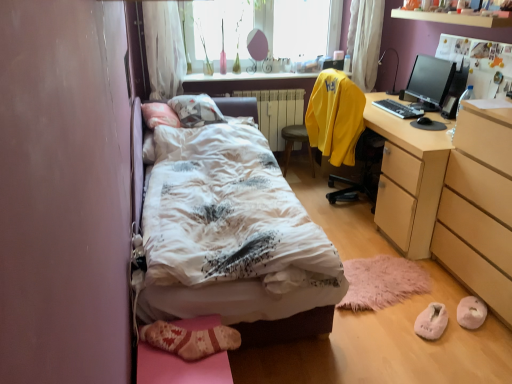
What is the approximate width of yellow fabric chair at center?

yellow fabric chair at center is 13.83 inches in width.

What do you see at coordinates (431, 321) in the screenshot? The image size is (512, 384). I see `pink fuzzy slippers at lower right, positioned as the 2th shoe in front-to-back order` at bounding box center [431, 321].

Where is `white sheer curtain at upper left, the 2th curtain in the right-to-left sequence`? This screenshot has height=384, width=512. white sheer curtain at upper left, the 2th curtain in the right-to-left sequence is located at coordinates (164, 48).

Where is `pink fluffy yoga mat at lower right`? pink fluffy yoga mat at lower right is located at coordinates (382, 282).

What's the angular difference between knitted wool socks at lower left, the 1th shoe positioned from the front, and black glossy monitor at upper right's facing directions?

The angular difference between knitted wool socks at lower left, the 1th shoe positioned from the front, and black glossy monitor at upper right is 179 degrees.

Who is bigger, knitted wool socks at lower left, the 1th shoe positioned from the front, or black glossy monitor at upper right?

knitted wool socks at lower left, the 1th shoe positioned from the front.

Is knitted wool socks at lower left, the 1th shoe positioned from the front, to the right of black glossy monitor at upper right from the viewer's perspective?

No.

Is knitted wool socks at lower left, the third shoe from the right, not close to black glossy monitor at upper right?

That's right, there is a large distance between knitted wool socks at lower left, the third shoe from the right, and black glossy monitor at upper right.

Which is correct: wooden shelf at upper center is inside black glossy monitor at upper right, or outside of it?

wooden shelf at upper center is spatially situated outside black glossy monitor at upper right.

From the image's perspective, is wooden shelf at upper center located beneath black glossy monitor at upper right?

No.

Does wooden shelf at upper center come behind black glossy monitor at upper right?

No.

Can you confirm if black plastic keyboard at right is wider than white metallic radiator at center?

Incorrect, the width of black plastic keyboard at right does not surpass that of white metallic radiator at center.

Which is in front, black plastic keyboard at right or white metallic radiator at center?

black plastic keyboard at right.

Which of these two, black plastic keyboard at right or white metallic radiator at center, stands shorter?

Standing shorter between the two is black plastic keyboard at right.

Where is `desktop on the right of white metallic radiator at center`? The height and width of the screenshot is (384, 512). desktop on the right of white metallic radiator at center is located at coordinates (398, 109).

From the image's perspective, which is above, white sheer curtain at upper center, which ranks as the 1th curtain in right-to-left order, or wooden shelf at upper center?

white sheer curtain at upper center, which ranks as the 1th curtain in right-to-left order.

From a real-world perspective, is white sheer curtain at upper center, which ranks as the 1th curtain in right-to-left order, physically above wooden shelf at upper center?

Incorrect, from a real-world perspective, white sheer curtain at upper center, which ranks as the 1th curtain in right-to-left order, is lower than wooden shelf at upper center.

In the scene shown: Considering the relative positions of white sheer curtain at upper center, which ranks as the 1th curtain in right-to-left order, and wooden shelf at upper center in the image provided, is white sheer curtain at upper center, which ranks as the 1th curtain in right-to-left order, to the left of wooden shelf at upper center from the viewer's perspective?

Yes, white sheer curtain at upper center, which ranks as the 1th curtain in right-to-left order, is to the left of wooden shelf at upper center.

Which is farther from the camera, (362, 55) or (442, 21)?

The point (362, 55) is behind.

Is knitted wool socks at lower left, arranged as the first shoe when viewed from the left, looking in the opposite direction of white printed fabric bed at center?

No, white printed fabric bed at center is not at the back of knitted wool socks at lower left, arranged as the first shoe when viewed from the left.

How different are the orientations of knitted wool socks at lower left, arranged as the first shoe when viewed from the left, and white printed fabric bed at center in degrees?

They differ by 90.1 degrees in their facing directions.

Which is in front, point (221, 331) or point (160, 209)?

Positioned in front is point (221, 331).

Measure the distance between white sheer curtain at upper center, which is the 2th curtain in left-to-right order, and transparent glass window at upper center.

white sheer curtain at upper center, which is the 2th curtain in left-to-right order, and transparent glass window at upper center are 21.97 inches apart.

Can we say white sheer curtain at upper center, which ranks as the 1th curtain in right-to-left order, lies outside transparent glass window at upper center?

Indeed, white sheer curtain at upper center, which ranks as the 1th curtain in right-to-left order, is completely outside transparent glass window at upper center.

From a real-world perspective, is white sheer curtain at upper center, which ranks as the 1th curtain in right-to-left order, located higher than transparent glass window at upper center?

No, from a real-world perspective, white sheer curtain at upper center, which ranks as the 1th curtain in right-to-left order, is not on top of transparent glass window at upper center.

In terms of size, does white printed fabric bed at center appear bigger or smaller than yellow matte sweatshirt at upper right?

Considering their sizes, white printed fabric bed at center takes up more space than yellow matte sweatshirt at upper right.

Which is more to the right, white printed fabric bed at center or yellow matte sweatshirt at upper right?

Positioned to the right is yellow matte sweatshirt at upper right.

Considering the relative sizes of white printed fabric bed at center and yellow matte sweatshirt at upper right in the image provided, is white printed fabric bed at center wider than yellow matte sweatshirt at upper right?

Yes.

Which is more distant, (266, 255) or (360, 102)?

Positioned behind is point (360, 102).

Locate an element on the screen. computer monitor that appears behind the knitted wool socks at lower left, the 1th shoe positioned from the front is located at coordinates (429, 82).

Find the location of a particular element. The image size is (512, 384). computer monitor located below the wooden shelf at upper center (from the image's perspective) is located at coordinates (429, 82).

Which object lies further to the anchor point white metallic radiator at center, yellow matte sweatshirt at upper right or pink fluffy yoga mat at lower right?

pink fluffy yoga mat at lower right is further to white metallic radiator at center.

From the image, which object appears to be farther from black glossy monitor at upper right, knitted wool socks at lower left, arranged as the first shoe when viewed from the left, or transparent glass window at upper center?

knitted wool socks at lower left, arranged as the first shoe when viewed from the left, is further to black glossy monitor at upper right.

Estimate the real-world distances between objects in this image. Which object is closer to white sheer curtain at upper left, which is the first curtain from left to right, white fluffy slippers at lower right, positioned as the 3th shoe in left-to-right order, or wooden shelf at upper center?

The object closer to white sheer curtain at upper left, which is the first curtain from left to right, is wooden shelf at upper center.

From the image, which object appears to be farther from pink fluffy yoga mat at lower right, white sheer curtain at upper center, which ranks as the 1th curtain in right-to-left order, or white metallic radiator at center?

white sheer curtain at upper center, which ranks as the 1th curtain in right-to-left order, is further to pink fluffy yoga mat at lower right.

Which object lies nearer to the anchor point yellow matte sweatshirt at upper right, black plastic keyboard at right or knitted wool socks at lower left, which appears as the 3th shoe when viewed from the back?

black plastic keyboard at right is closer to yellow matte sweatshirt at upper right.

Considering their positions, is knitted wool socks at lower left, arranged as the first shoe when viewed from the left, positioned closer to white metallic radiator at center than white sheer curtain at upper left, which is the first curtain from left to right?

Based on the image, white sheer curtain at upper left, which is the first curtain from left to right, appears to be nearer to white metallic radiator at center.

Based on their spatial positions, is white metallic radiator at center or pink fuzzy slippers at lower right, arranged as the 2th shoe when viewed from the back, closer to transparent glass window at upper center?

white metallic radiator at center is closer to transparent glass window at upper center.

Consider the image. Based on their spatial positions, is yellow matte sweatshirt at upper right or knitted wool socks at lower left, the third shoe from the right, closer to pink fluffy yoga mat at lower right?

The object closer to pink fluffy yoga mat at lower right is yellow matte sweatshirt at upper right.

Find the location of a particular element. The width and height of the screenshot is (512, 384). window screen between yellow matte sweatshirt at upper right and white metallic radiator at center along the z-axis is located at coordinates pyautogui.click(x=295, y=27).

You are a GUI agent. You are given a task and a screenshot of the screen. Output one action in this format:
    pyautogui.click(x=<x>, y=<y>)
    Task: Click on the chair between white sheer curtain at upper center, which is the 2th curtain in left-to-right order, and white fluffy slippers at lower right, the 1th shoe viewed from the back, vertically
    This screenshot has height=384, width=512.
    Given the screenshot: What is the action you would take?
    pyautogui.click(x=294, y=142)

The image size is (512, 384). I want to click on bed located between white sheer curtain at upper left, which is the first curtain from left to right, and black glossy monitor at upper right in the left-right direction, so click(x=233, y=238).

Locate an element on the screen. yoga mat between light brown wood dresser at right and black plastic keyboard at right along the z-axis is located at coordinates (382, 282).